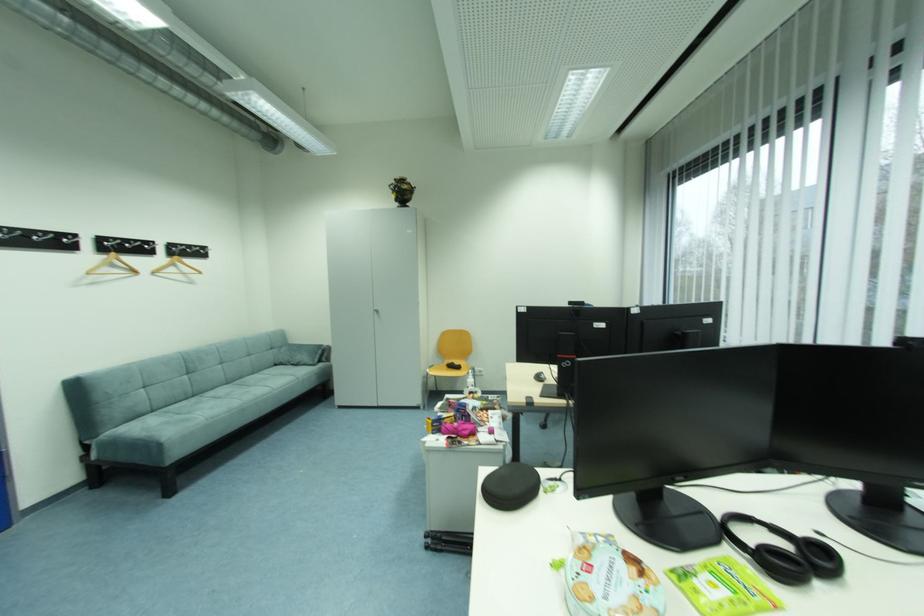
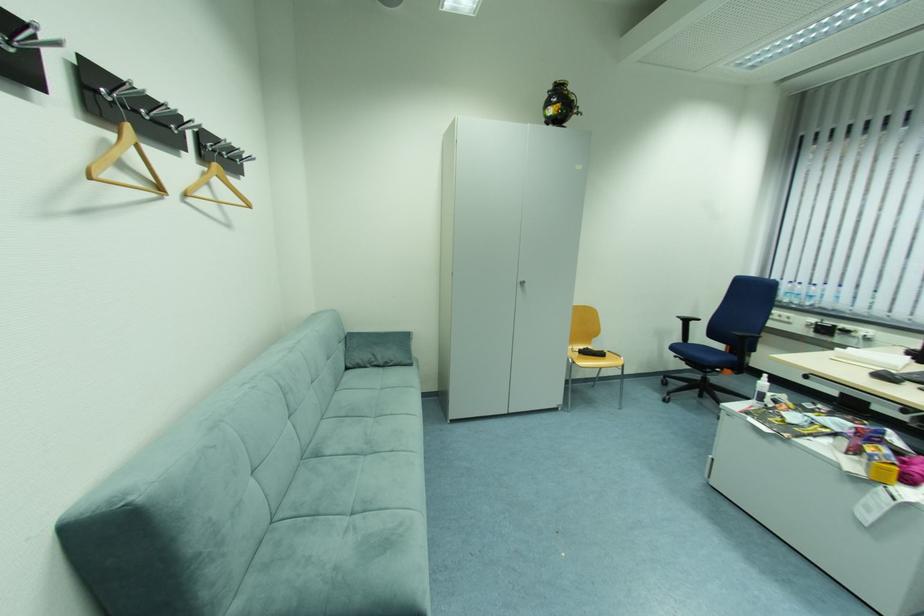
Locate, in the second image, the point that corresponds to (399,183) in the first image.

(558, 87)